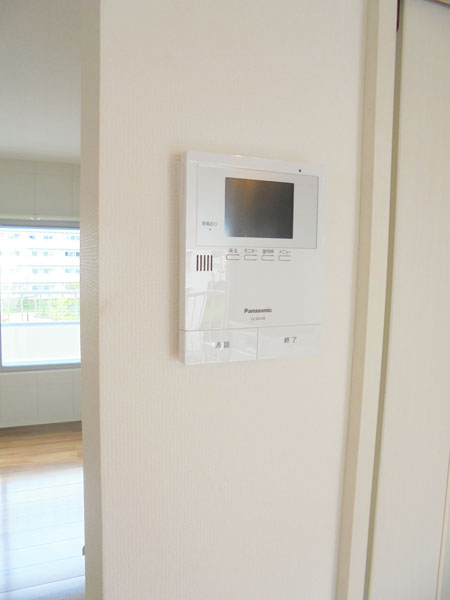
Locate an element on the screen. Image resolution: width=450 pixels, height=600 pixels. ceiling is located at coordinates (48, 40).